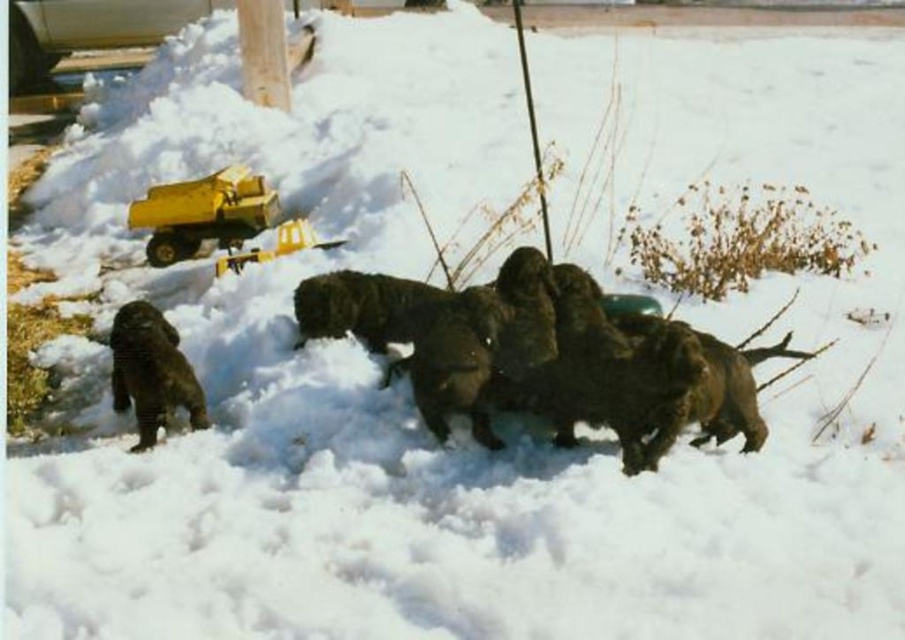
Question: Which object is positioned closest to the smooth wood pole at upper center?

Choices:
 (A) fuzzy brown dog at center
 (B) fuzzy brown dog at left
 (C) yellow plastic toy at upper left
 (D) smooth wooden pole at upper center

Answer: (D)

Question: Can you confirm if yellow plastic toy at upper left is positioned to the left of fuzzy brown dog at left?

Choices:
 (A) yes
 (B) no

Answer: (A)

Question: Does fuzzy brown dog at center appear over smooth wooden pole at upper center?

Choices:
 (A) yes
 (B) no

Answer: (B)

Question: Which point is closer to the camera?

Choices:
 (A) (210, 212)
 (B) (249, 65)

Answer: (A)

Question: Is yellow plastic toy at upper left thinner than smooth wooden pole at upper center?

Choices:
 (A) yes
 (B) no

Answer: (B)

Question: Which of the following is the closest to the observer?

Choices:
 (A) smooth wooden pole at upper center
 (B) smooth wood pole at upper center
 (C) yellow plastic toy at upper left

Answer: (C)